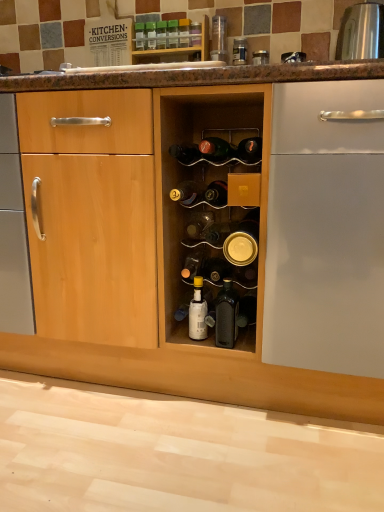
Question: In terms of height, does green glass bottle at center, the 12th bottle positioned from the bottom, look taller or shorter compared to gold metallic can at center, the fifth bottle positioned from the bottom?

Choices:
 (A) tall
 (B) short

Answer: (B)

Question: In terms of width, does green glass bottle at center, acting as the second bottle starting from the top, look wider or thinner when compared to gold metallic can at center, the fifth bottle positioned from the bottom?

Choices:
 (A) wide
 (B) thin

Answer: (B)

Question: Considering the real-world distances, which object is farthest from the green glass bottle at center?

Choices:
 (A) translucent glass bottle at center, arranged as the 6th bottle when ordered from the bottom
 (B) matte black bottle at center, which is the 11th bottle in top-to-bottom order
 (C) gold metallic can at center, marked as the 9th bottle in a top-to-bottom arrangement
 (D) black glass bottle at center, marked as the thirteenth bottle in a top-to-bottom arrangement
 (E) translucent glass bottle at center, marked as the seventh bottle in a top-to-bottom arrangement

Answer: (D)

Question: Based on their relative distances, which object is nearer to the gold metallic can at center, the fifth bottle positioned from the bottom?

Choices:
 (A) white glossy bottle at center, which is the second bottle in bottom-to-top order
 (B) translucent glass bottle at center, the seventh bottle in the bottom-to-top sequence
 (C) black glass bottle at center, marked as the thirteenth bottle in a top-to-bottom arrangement
 (D) matte black bottle at center, the eighth bottle from the bottom
 (E) green glass bottle at upper center, the 13th bottle in the bottom-to-top sequence

Answer: (B)